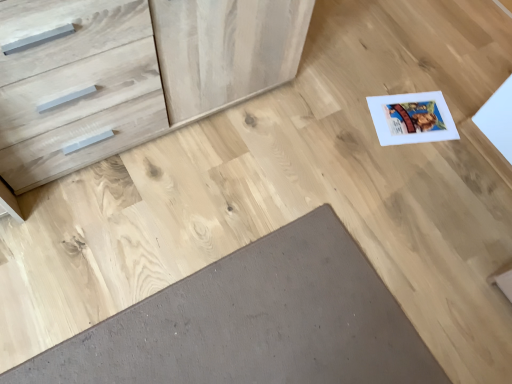
Identify the location of vacant space to the right of natural wood chest of drawers at upper left. Image resolution: width=512 pixels, height=384 pixels. (334, 127).